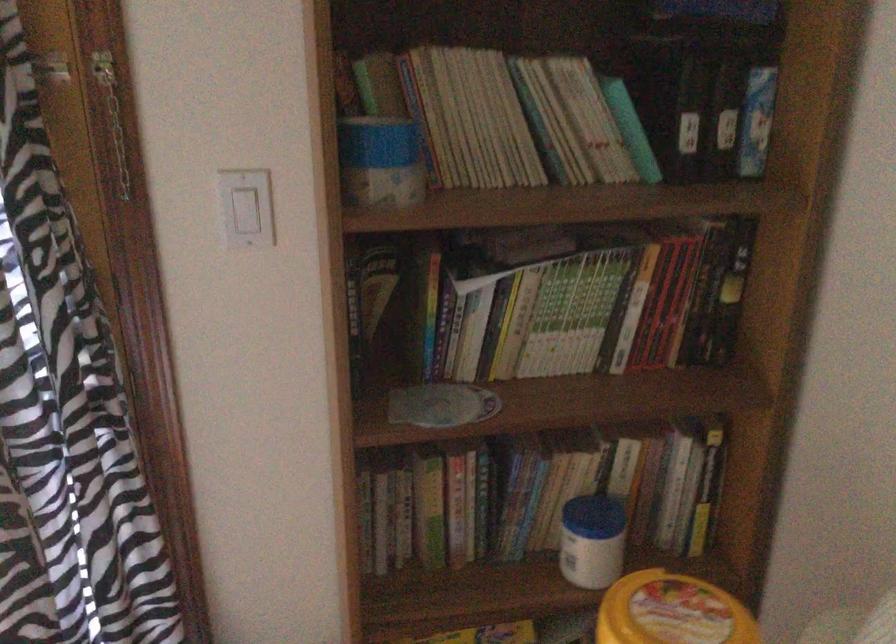
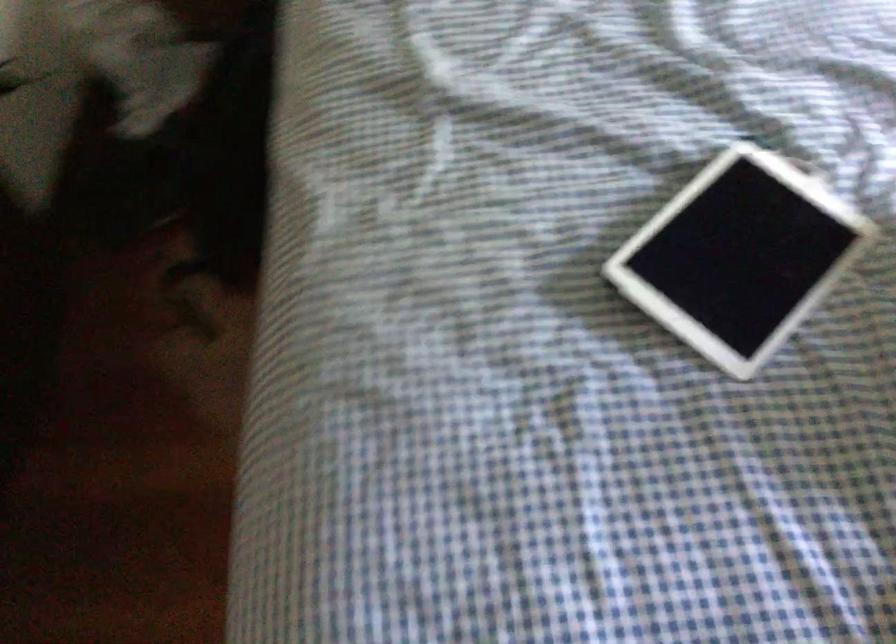
Looking at this image, first-person continuous shooting, in which direction is the camera rotating?

The camera's rotation is toward left-down.